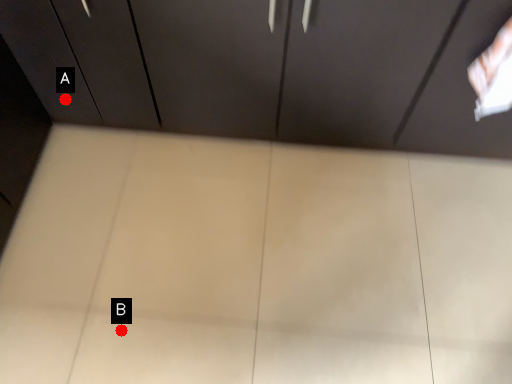
Question: Two points are circled on the image, labeled by A and B beside each circle. Which point appears farthest from the camera in this image?

Choices:
 (A) A is further
 (B) B is further

Answer: (A)